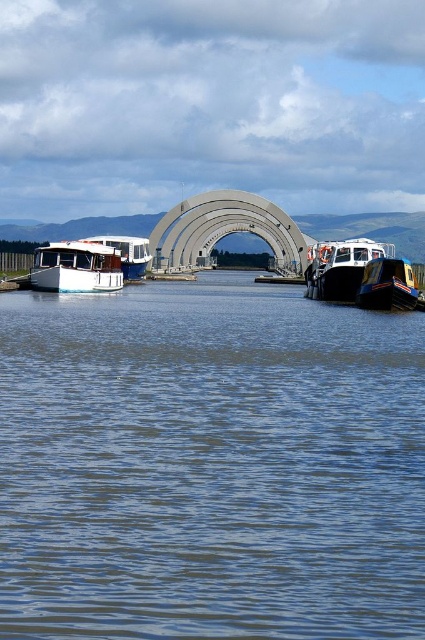
Between white glossy barge at right and white glossy boat at left, which one has more height?

white glossy boat at left is taller.

Is point (320, 273) in front of point (142, 273)?

Yes.

This screenshot has height=640, width=425. I want to click on white glossy barge at right, so click(342, 268).

Can you confirm if concrete bridge at center is thinner than white glossy barge at right?

No.

Who is higher up, concrete bridge at center or white glossy barge at right?

concrete bridge at center

Is point (263, 205) more distant than point (363, 272)?

That is True.

In order to click on concrete bridge at center in this screenshot , I will do `click(224, 230)`.

Between blue water at center and blue glossy boat at lower right, which one appears on the left side from the viewer's perspective?

From the viewer's perspective, blue water at center appears more on the left side.

Who is taller, blue water at center or blue glossy boat at lower right?

blue water at center is taller.

Which is behind, point (70, 620) or point (359, 305)?

Point (359, 305)

At what (x,y) coordinates should I click in order to perform the action: click on blue water at center. Please return your answer as a coordinate pair (x, y). The height and width of the screenshot is (640, 425). Looking at the image, I should click on (209, 465).